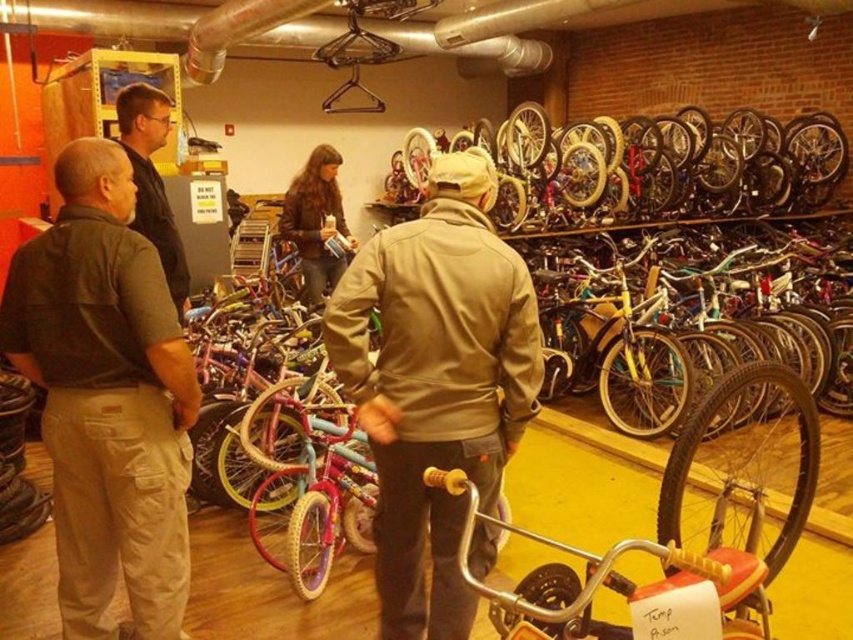
You are a customer looking to buy a jacket that can withstand heavy rain. You see the tan softshell jacket at center and the dark brown leather jacket at left. Which jacket is taller and therefore might provide better coverage against rain?

The tan softshell jacket at center is much taller as dark brown leather jacket at left, so it might provide better coverage against rain.

You are a person who wants to hang a picture frame on the wall between the dark brown cargo pants at left and the tan softshell jacket at center. Since the frame is 1.2 meters tall, will it fit vertically between these two items?

The dark brown cargo pants at left is taller than the tan softshell jacket at center. Therefore, the space between them is at least as tall as the taller object, which is the dark brown cargo pants at left. Since the picture frame is 1.2 meters tall, it can fit vertically between them if the distance between the two items allows. However, without knowing the exact height of the taller object, we can only confirm that the minimum available height is equal to the height of the tan softshell jacket at center.

What is located at the coordinates point (106, 397) in the image?

The point (106, 397) indicates dark brown cargo pants at left.